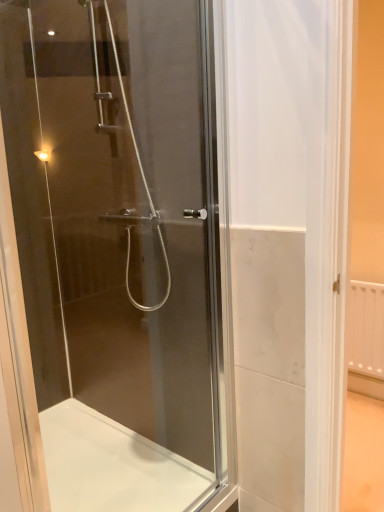
Question: Is white glossy bath at lower center far from transparent glass shower door at center?

Choices:
 (A) yes
 (B) no

Answer: (B)

Question: Is white glossy bath at lower center in front of transparent glass shower door at center?

Choices:
 (A) yes
 (B) no

Answer: (B)

Question: Is white glossy bath at lower center completely or partially outside of transparent glass shower door at center?

Choices:
 (A) no
 (B) yes

Answer: (B)

Question: Is white glossy bath at lower center to the right of transparent glass shower door at center from the viewer's perspective?

Choices:
 (A) no
 (B) yes

Answer: (A)

Question: From a real-world perspective, is white glossy bath at lower center located higher than transparent glass shower door at center?

Choices:
 (A) no
 (B) yes

Answer: (A)

Question: Does white glossy bath at lower center have a lesser width compared to transparent glass shower door at center?

Choices:
 (A) no
 (B) yes

Answer: (A)

Question: Considering the relative sizes of transparent glass shower door at center and white glossy bath at lower center in the image provided, is transparent glass shower door at center bigger than white glossy bath at lower center?

Choices:
 (A) no
 (B) yes

Answer: (A)

Question: Does transparent glass shower door at center come behind white glossy bath at lower center?

Choices:
 (A) yes
 (B) no

Answer: (B)

Question: Is transparent glass shower door at center next to white glossy bath at lower center?

Choices:
 (A) yes
 (B) no

Answer: (B)

Question: Is transparent glass shower door at center located outside white glossy bath at lower center?

Choices:
 (A) no
 (B) yes

Answer: (B)

Question: Is transparent glass shower door at center far away from white glossy bath at lower center?

Choices:
 (A) yes
 (B) no

Answer: (B)

Question: Is transparent glass shower door at center taller than white glossy bath at lower center?

Choices:
 (A) yes
 (B) no

Answer: (A)

Question: In terms of width, does transparent glass shower door at center look wider or thinner when compared to white glossy bath at lower center?

Choices:
 (A) wide
 (B) thin

Answer: (B)